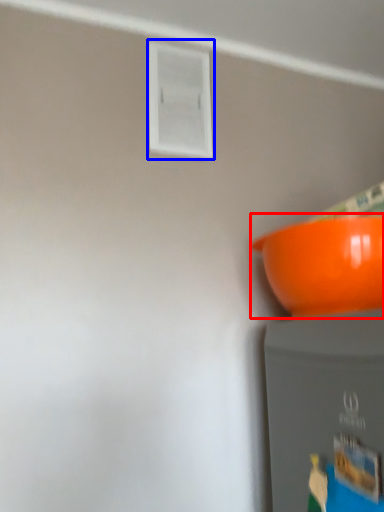
Question: Which point is further to the camera, bowl (highlighted by a red box) or window (highlighted by a blue box)?

Choices:
 (A) bowl
 (B) window

Answer: (B)